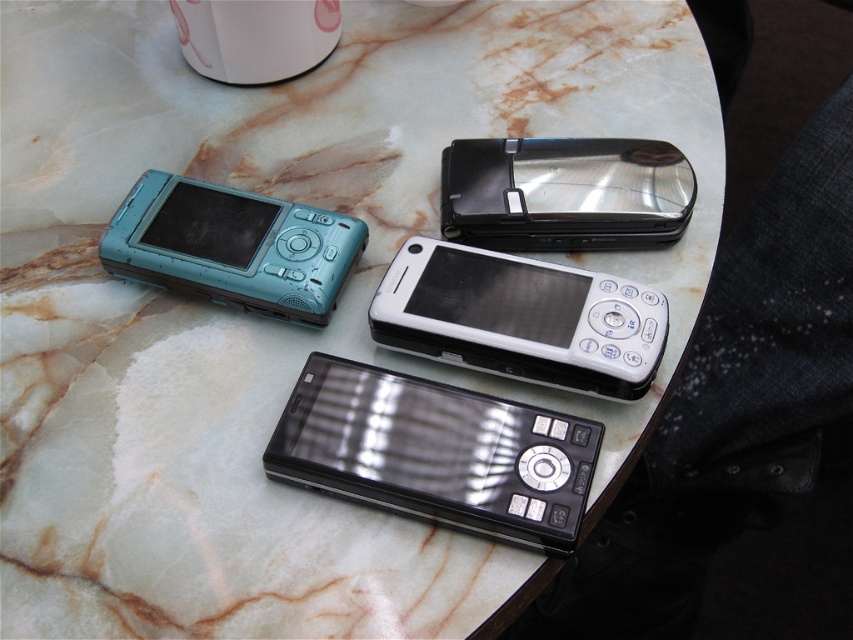
You are a delivery person who needs to place a new phone on the table without touching the existing phones. The new phone is 3 inches wide. Can you fit it between the black glossy smartphone at center and the teal plastic camera at upper left?

The black glossy smartphone at center is 7.20 inches away from the teal plastic camera at upper left. Since the new phone is only 3 inches wide, there is enough space between them to place it without touching either.

You are organizing a vintage phone exhibition and need to arrange the black glossy smartphone at center and the metallic silver flip phone at upper right. According to their positions in the image, which phone should be placed higher on the display shelf to maintain the original layout?

The metallic silver flip phone at upper right should be placed higher on the display shelf because in the original image, the black glossy smartphone at center is located below the metallic silver flip phone at upper right.